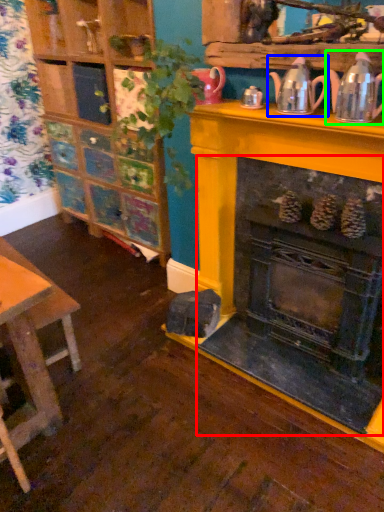
Question: Which object is positioned closest to fireplace (highlighted by a red box)? Select from tea pot (highlighted by a blue box) and tea pot (highlighted by a green box).

Choices:
 (A) tea pot
 (B) tea pot

Answer: (B)